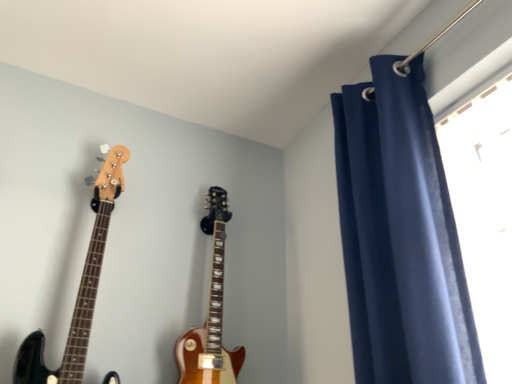
Question: Is navy blue velvet curtain at upper right facing towards glossy wood guitar at left, acting as the 1th guitar starting from the left?

Choices:
 (A) yes
 (B) no

Answer: (B)

Question: Does navy blue velvet curtain at upper right appear on the right side of glossy wood guitar at left, the second guitar positioned from the right?

Choices:
 (A) yes
 (B) no

Answer: (A)

Question: Would you say navy blue velvet curtain at upper right is outside glossy wood guitar at left, the second guitar positioned from the right?

Choices:
 (A) yes
 (B) no

Answer: (A)

Question: Is glossy wood guitar at left, acting as the 1th guitar starting from the left, located within navy blue velvet curtain at upper right?

Choices:
 (A) yes
 (B) no

Answer: (B)

Question: Is navy blue velvet curtain at upper right positioned with its back to glossy wood guitar at left, acting as the 1th guitar starting from the left?

Choices:
 (A) yes
 (B) no

Answer: (B)

Question: Considering the relative sizes of navy blue velvet curtain at upper right and glossy wood guitar at left, acting as the 1th guitar starting from the left, in the image provided, is navy blue velvet curtain at upper right taller than glossy wood guitar at left, acting as the 1th guitar starting from the left,?

Choices:
 (A) no
 (B) yes

Answer: (B)

Question: Could you tell me if glossy wood guitar at center, marked as the 2th guitar in a left-to-right arrangement, is facing navy blue velvet curtain at upper right?

Choices:
 (A) yes
 (B) no

Answer: (A)

Question: From a real-world perspective, is glossy wood guitar at center, marked as the 2th guitar in a left-to-right arrangement, over navy blue velvet curtain at upper right?

Choices:
 (A) no
 (B) yes

Answer: (A)

Question: Considering the relative sizes of glossy wood guitar at center, marked as the 2th guitar in a left-to-right arrangement, and navy blue velvet curtain at upper right in the image provided, is glossy wood guitar at center, marked as the 2th guitar in a left-to-right arrangement, smaller than navy blue velvet curtain at upper right?

Choices:
 (A) yes
 (B) no

Answer: (A)

Question: Is glossy wood guitar at center, marked as the 2th guitar in a left-to-right arrangement, bigger than navy blue velvet curtain at upper right?

Choices:
 (A) no
 (B) yes

Answer: (A)

Question: Is glossy wood guitar at center, marked as the 2th guitar in a left-to-right arrangement, not within navy blue velvet curtain at upper right?

Choices:
 (A) yes
 (B) no

Answer: (A)

Question: Does glossy wood guitar at center, which is the 1th guitar from right to left, appear on the left side of navy blue velvet curtain at upper right?

Choices:
 (A) yes
 (B) no

Answer: (A)

Question: Can you confirm if glossy wood guitar at center, which is the 1th guitar from right to left, is positioned to the left of glossy wood guitar at left, the second guitar positioned from the right?

Choices:
 (A) yes
 (B) no

Answer: (B)